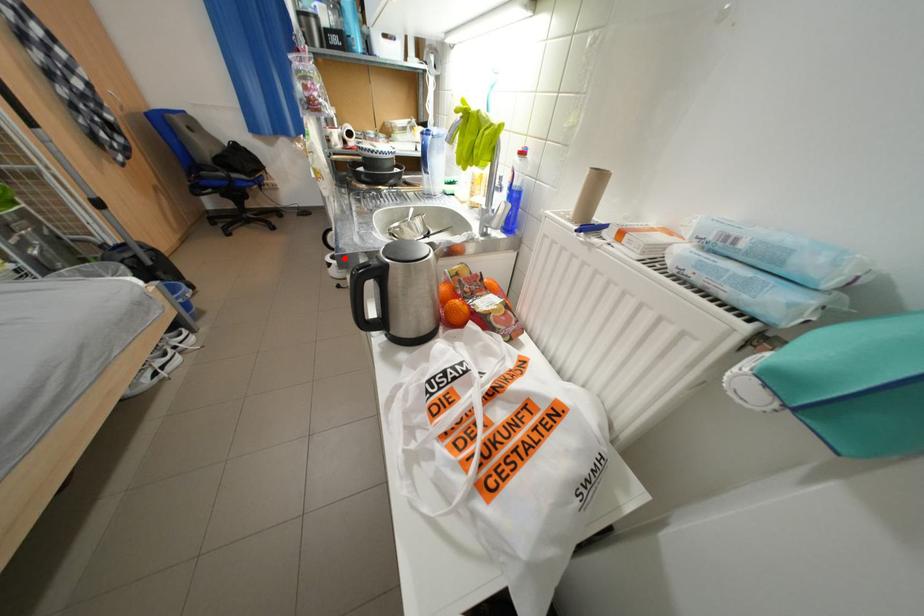
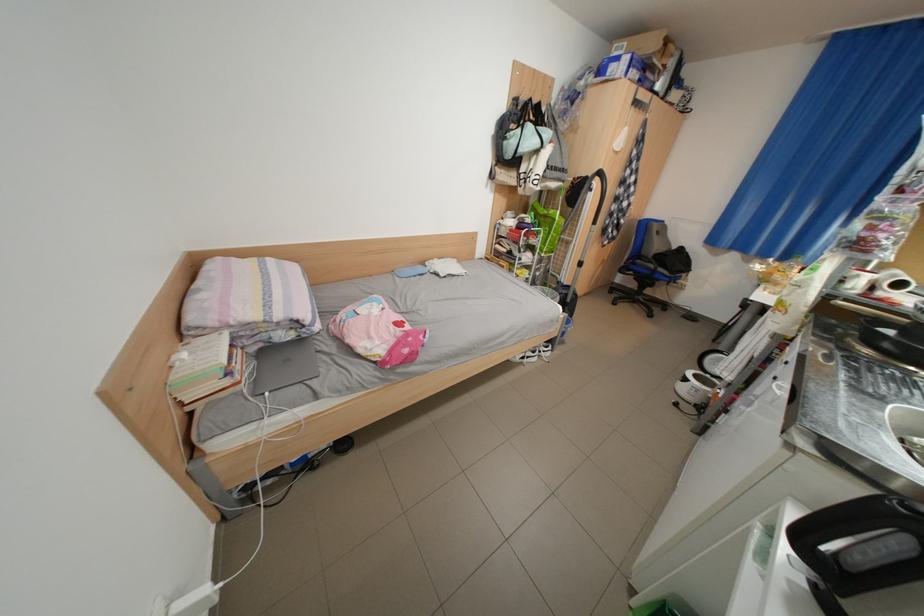
The point at the highlighted location is marked in the first image. Where is the corresponding point in the second image?

(708, 377)